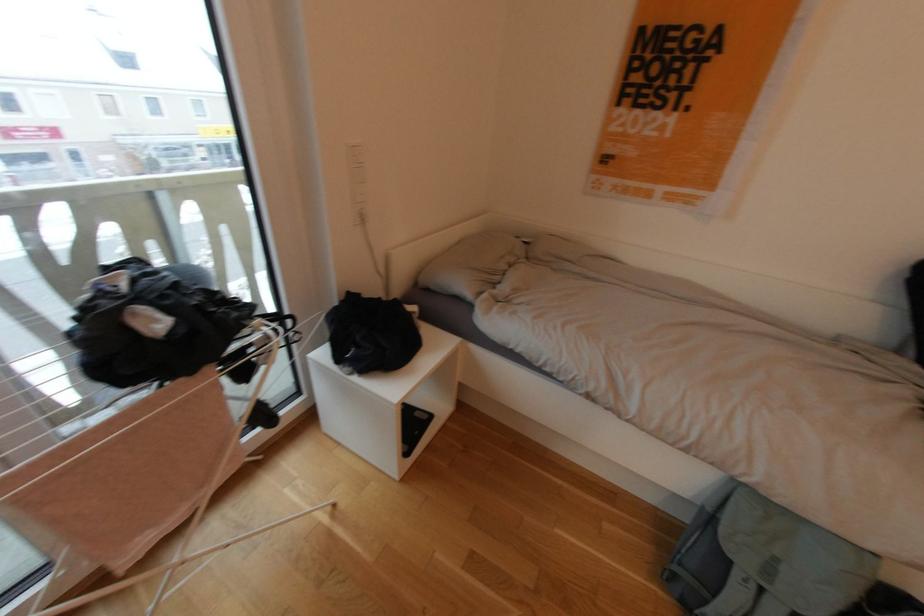
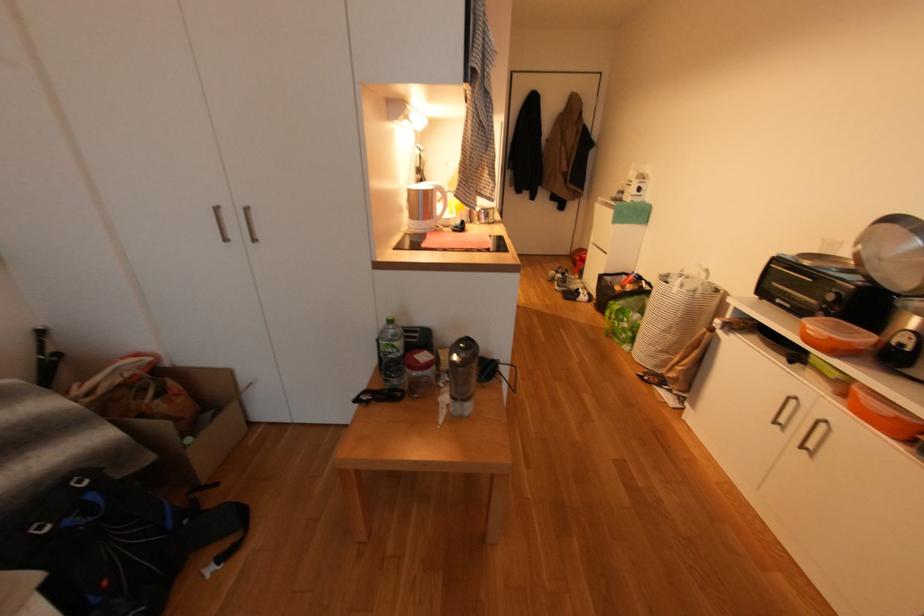
The first image is from the beginning of the video and the second image is from the end. How did the camera likely rotate when shooting the video?

The camera's rotation is toward right-down.